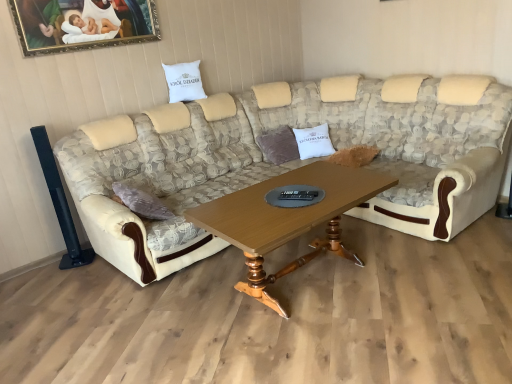
You are a GUI agent. You are given a task and a screenshot of the screen. Output one action in this format:
    pyautogui.click(x=<x>, y=<y>)
    Task: Click on the unoccupied region to the right of woodenwoodencoffee table at center
    The height and width of the screenshot is (384, 512).
    Given the screenshot: What is the action you would take?
    pyautogui.click(x=430, y=278)